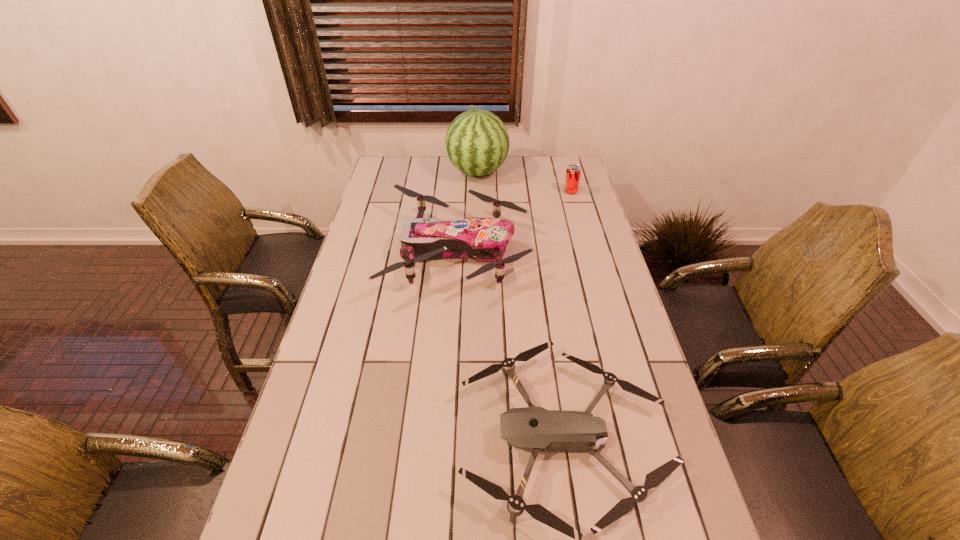
You are a GUI agent. You are given a task and a screenshot of the screen. Output one action in this format:
    pyautogui.click(x=<x>, y=<y>)
    Task: Click on the free space that satisfies the following two spatial constraints: 1. on the front side of the soda can; 2. on the front-facing side of the taller drone
    The height and width of the screenshot is (540, 960).
    Given the screenshot: What is the action you would take?
    pyautogui.click(x=588, y=252)